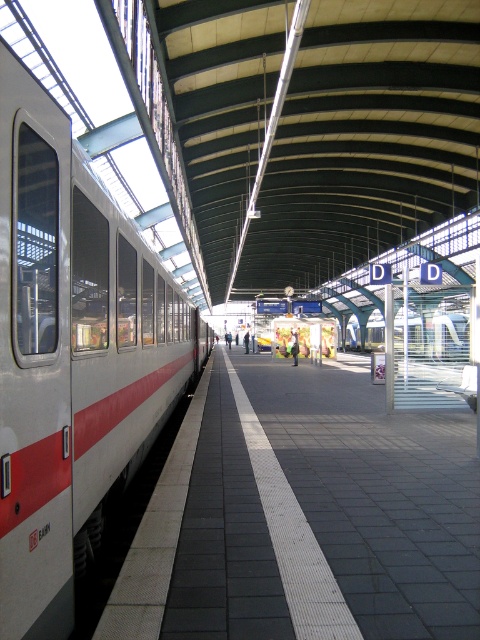
You are a luggage cart that is 3 feet wide. You are currently on the white glossy platform at center and want to move towards the white glossy train at left. Is there enough space for you to pass through the area between them?

The distance between the white glossy platform at center and the white glossy train at left is 8.88 feet. Since the cart is only 3 feet wide, there is sufficient space for the cart to pass through the area between them.

You are a passenger waiting on the platform and want to board the taller train. Which one should you choose between the white glossy train at left and the white glossy train at center?

The white glossy train at center is taller than the white glossy train at left, so you should board the white glossy train at center.

You are standing at the point marked by coordinates point [304,513] on the platform. Looking around, you see the DB Bahn train with white body and red stripe on the left side. Which direction should you walk to reach the train?

The point [304,513] is located at the white glossy platform at center. Since the DB Bahn train with white body and red stripe is on the left side, you should walk to the left to reach the train.